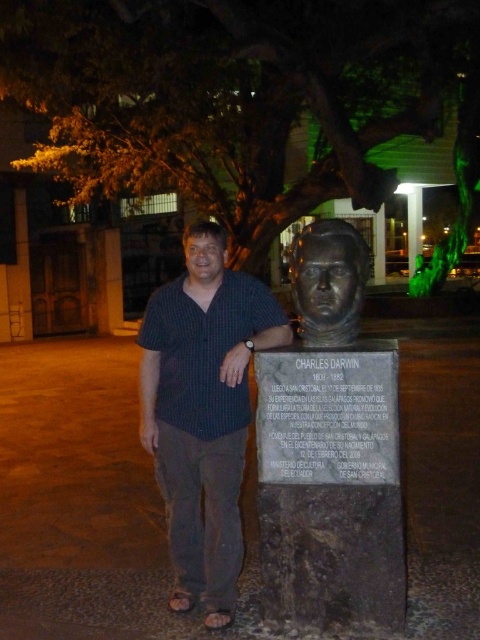
You are a photographer standing in front of the bronze bust at center. You want to take a photo of the bust but your camera has a minimum focus distance of 3 meters. Will you be able to take a clear photo without moving closer?

The bronze bust at center is 2.67 meters away from camera, which is within the camera minimum focus distance of 3 meters. Therefore, you can take a clear photo without moving closer.

You are a photographer trying to capture a group photo of the man in the dark blue shirt at center and the bronze statue at center. If your camera can only focus on objects within a 1.2 meter width, will both fit in the frame?

The dark blue shirt at center might be wider than bronze statue at center, so it is uncertain if both will fit within the 1.2 meter width. Check the actual width before taking the photo.

You are a photographer standing in front of the bronze bust of Charles Darwin. You notice two points marked on the image at coordinates point (x=273, y=449) and point (x=328, y=308). Which point is closer to you?

Point (x=273, y=449) is closer to you because it is further to the viewer than point (x=328, y=308).